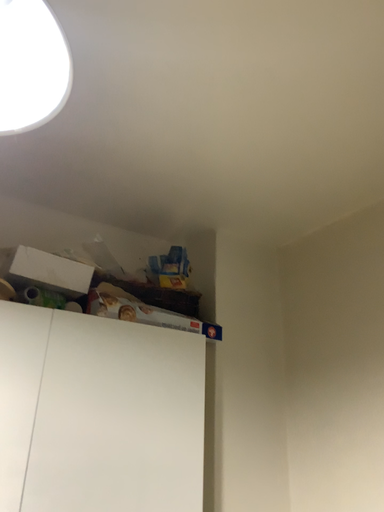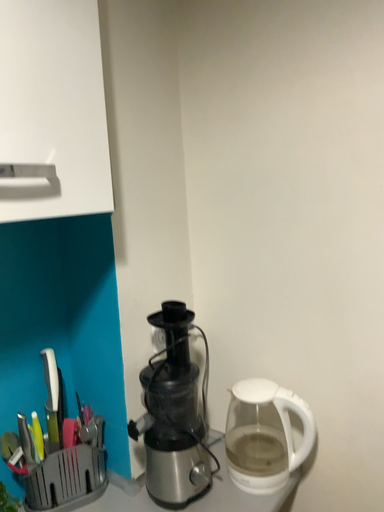
Question: Which way did the camera rotate in the video?

Choices:
 (A) rotated downward
 (B) rotated upward

Answer: (A)